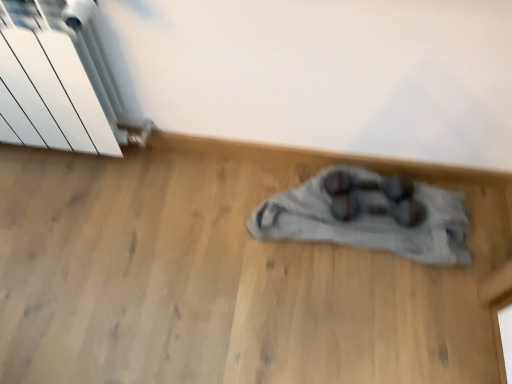
Describe the element at coordinates (59, 80) in the screenshot. I see `white metallic radiator at upper left` at that location.

In order to face white metallic radiator at upper left, should I rotate leftwards or rightwards?

Turn left approximately 27.580 degrees to face it.

This screenshot has height=384, width=512. Identify the location of white metallic radiator at upper left. (59, 80).

The height and width of the screenshot is (384, 512). I want to click on shiny black dumbbells at center, so (x=374, y=190).

In order to face shiny black dumbbells at center, should I rotate leftwards or rightwards?

A 16.306 degree turn to the right will do.

Image resolution: width=512 pixels, height=384 pixels. What do you see at coordinates (374, 190) in the screenshot?
I see `shiny black dumbbells at center` at bounding box center [374, 190].

Find the location of a particular element. This screenshot has width=512, height=384. white metallic radiator at upper left is located at coordinates (59, 80).

Considering the relative positions of shiny black dumbbells at center and white metallic radiator at upper left in the image provided, is shiny black dumbbells at center to the right of white metallic radiator at upper left from the viewer's perspective?

Indeed, shiny black dumbbells at center is positioned on the right side of white metallic radiator at upper left.

Which object is further away from the camera taking this photo, shiny black dumbbells at center or white metallic radiator at upper left?

shiny black dumbbells at center is further away from the camera.

Does point (367, 181) come closer to viewer compared to point (32, 13)?

That is False.

From the image's perspective, is shiny black dumbbells at center above white metallic radiator at upper left?

No.

From a real-world perspective, which is physically above, shiny black dumbbells at center or white metallic radiator at upper left?

white metallic radiator at upper left.

Considering the relative sizes of shiny black dumbbells at center and white metallic radiator at upper left in the image provided, is shiny black dumbbells at center wider than white metallic radiator at upper left?

Correct, the width of shiny black dumbbells at center exceeds that of white metallic radiator at upper left.

In the scene shown: Which of these two, shiny black dumbbells at center or white metallic radiator at upper left, stands taller?

With more height is white metallic radiator at upper left.

Considering the sizes of shiny black dumbbells at center and white metallic radiator at upper left in the image, is shiny black dumbbells at center bigger or smaller than white metallic radiator at upper left?

Considering their sizes, shiny black dumbbells at center takes up less space than white metallic radiator at upper left.

Do you think shiny black dumbbells at center is within white metallic radiator at upper left, or outside of it?

shiny black dumbbells at center cannot be found inside white metallic radiator at upper left.

Is shiny black dumbbells at center not near white metallic radiator at upper left?

They are positioned close to each other.

Could you tell me if shiny black dumbbells at center is turned towards white metallic radiator at upper left?

No, shiny black dumbbells at center is not oriented towards white metallic radiator at upper left.

Identify the location of radiator lying in front of the shiny black dumbbells at center. (59, 80).

Which is more to the left, white metallic radiator at upper left or shiny black dumbbells at center?

Positioned to the left is white metallic radiator at upper left.

Is white metallic radiator at upper left in front of or behind shiny black dumbbells at center in the image?

In the image, white metallic radiator at upper left appears in front of shiny black dumbbells at center.

Does point (67, 117) come in front of point (341, 209)?

Yes.

From the image's perspective, is white metallic radiator at upper left below shiny black dumbbells at center?

No, from the image's perspective, white metallic radiator at upper left is not beneath shiny black dumbbells at center.

From a real-world perspective, which is physically below, white metallic radiator at upper left or shiny black dumbbells at center?

From a 3D spatial view, shiny black dumbbells at center is below.

Is white metallic radiator at upper left wider than shiny black dumbbells at center?

Incorrect, the width of white metallic radiator at upper left does not surpass that of shiny black dumbbells at center.

Looking at this image, between white metallic radiator at upper left and shiny black dumbbells at center, which one has more height?

With more height is white metallic radiator at upper left.

Does white metallic radiator at upper left have a smaller size compared to shiny black dumbbells at center?

Actually, white metallic radiator at upper left might be larger than shiny black dumbbells at center.

Which is correct: white metallic radiator at upper left is inside shiny black dumbbells at center, or outside of it?

white metallic radiator at upper left is spatially situated outside shiny black dumbbells at center.

Is white metallic radiator at upper left next to shiny black dumbbells at center and touching it?

No, white metallic radiator at upper left is not in contact with shiny black dumbbells at center.

Is white metallic radiator at upper left oriented away from shiny black dumbbells at center?

white metallic radiator at upper left does not have its back to shiny black dumbbells at center.

How different are the orientations of white metallic radiator at upper left and shiny black dumbbells at center in degrees?

There is a 3.62-degree angle between the facing directions of white metallic radiator at upper left and shiny black dumbbells at center.

Find the location of a particular element. The height and width of the screenshot is (384, 512). radiator in front of the shiny black dumbbells at center is located at coordinates (59, 80).

The width and height of the screenshot is (512, 384). In order to click on radiator on the left of shiny black dumbbells at center in this screenshot , I will do `click(59, 80)`.

Locate an element on the screen. The width and height of the screenshot is (512, 384). footwear beneath the white metallic radiator at upper left (from a real-world perspective) is located at coordinates (374, 190).